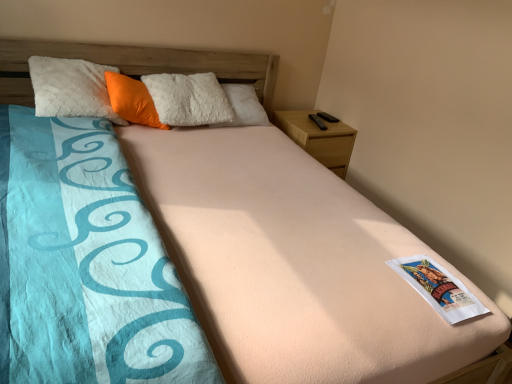
Question: Is white paper at center facing towards wooden nightstand at upper right?

Choices:
 (A) yes
 (B) no

Answer: (B)

Question: From a real-world perspective, is white paper at center located beneath wooden nightstand at upper right?

Choices:
 (A) no
 (B) yes

Answer: (A)

Question: Does white paper at center have a smaller size compared to wooden nightstand at upper right?

Choices:
 (A) yes
 (B) no

Answer: (A)

Question: Considering the relative positions of white paper at center and wooden nightstand at upper right in the image provided, is white paper at center to the right of wooden nightstand at upper right from the viewer's perspective?

Choices:
 (A) no
 (B) yes

Answer: (B)

Question: From the image's perspective, is white paper at center over wooden nightstand at upper right?

Choices:
 (A) yes
 (B) no

Answer: (B)

Question: From the image's perspective, is wooden nightstand at upper right above or below orange plush pillow at upper left?

Choices:
 (A) above
 (B) below

Answer: (B)

Question: Relative to orange plush pillow at upper left, is wooden nightstand at upper right in front or behind?

Choices:
 (A) behind
 (B) front

Answer: (A)

Question: From their relative heights in the image, would you say wooden nightstand at upper right is taller or shorter than orange plush pillow at upper left?

Choices:
 (A) short
 (B) tall

Answer: (B)

Question: In terms of size, does wooden nightstand at upper right appear bigger or smaller than orange plush pillow at upper left?

Choices:
 (A) small
 (B) big

Answer: (B)

Question: Looking at their shapes, would you say white paper at center is wider or thinner than wooden nightstand at upper right?

Choices:
 (A) wide
 (B) thin

Answer: (B)

Question: Looking at the image, does white paper at center seem bigger or smaller compared to wooden nightstand at upper right?

Choices:
 (A) small
 (B) big

Answer: (A)

Question: From a real-world perspective, is white paper at center positioned above or below wooden nightstand at upper right?

Choices:
 (A) below
 (B) above

Answer: (B)

Question: In the image, is white paper at center on the left side or the right side of wooden nightstand at upper right?

Choices:
 (A) right
 (B) left

Answer: (A)

Question: In terms of height, does orange plush pillow at upper left look taller or shorter compared to wooden nightstand at upper right?

Choices:
 (A) short
 (B) tall

Answer: (A)

Question: Considering the positions of orange plush pillow at upper left and wooden nightstand at upper right in the image, is orange plush pillow at upper left wider or thinner than wooden nightstand at upper right?

Choices:
 (A) wide
 (B) thin

Answer: (B)